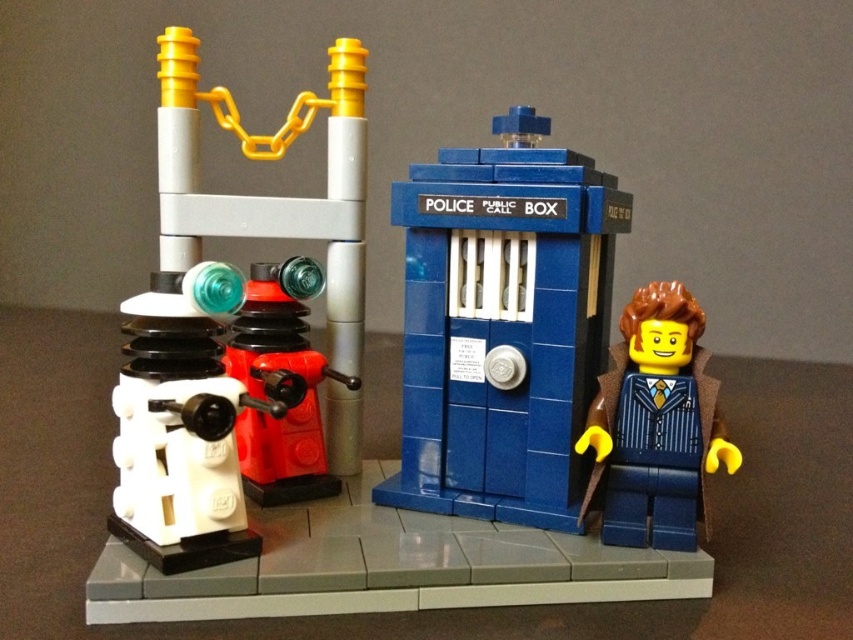
Question: Does blue plastic police box at center lie behind white plastic microscope at center-left?

Choices:
 (A) no
 (B) yes

Answer: (B)

Question: Among these objects, which one is nearest to the camera?

Choices:
 (A) matte plastic dalek at left
 (B) shiny red plastic dalek at center-left

Answer: (A)

Question: Does blue plastic police box at center have a greater width compared to white plastic microscope at center-left?

Choices:
 (A) yes
 (B) no

Answer: (A)

Question: Is blue plastic police box at center smaller than blue glossy suit at right?

Choices:
 (A) no
 (B) yes

Answer: (A)

Question: Which point is closer to the camera?

Choices:
 (A) blue glossy suit at right
 (B) white plastic microscope at center-left
 (C) shiny red plastic dalek at center-left
 (D) blue plastic police box at center

Answer: (B)

Question: Which object is closer to the camera taking this photo?

Choices:
 (A) blue plastic police box at center
 (B) white plastic microscope at center-left
 (C) shiny red plastic dalek at center-left

Answer: (B)